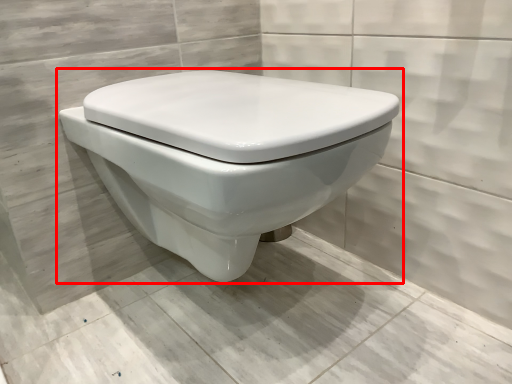
Question: Where is toilet (annotated by the red box) located in relation to concrete in the image?

Choices:
 (A) right
 (B) left

Answer: (A)